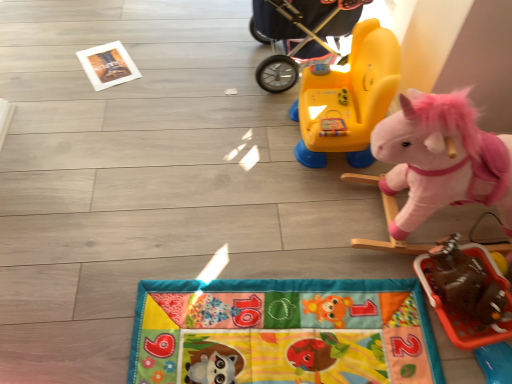
Identify the location of yellow plastic baby carriage at upper center. (298, 33).

The image size is (512, 384). I want to click on yellow plastic rocker at upper center, the 3th toy when ordered from bottom to top, so click(348, 99).

Locate an element on the screen. This screenshot has height=384, width=512. yellow plastic baby carriage at upper center is located at coordinates (298, 33).

Which object is more forward, brown fuzzy elephant at lower right, positioned as the first toy in bottom-to-top order, or yellow plastic rocker at upper center, the 3th toy when ordered from bottom to top?

brown fuzzy elephant at lower right, positioned as the first toy in bottom-to-top order.

Considering the positions of objects brown fuzzy elephant at lower right, positioned as the first toy in bottom-to-top order, and yellow plastic rocker at upper center, the 3th toy when ordered from bottom to top, in the image provided, who is more to the left, brown fuzzy elephant at lower right, positioned as the first toy in bottom-to-top order, or yellow plastic rocker at upper center, the 3th toy when ordered from bottom to top,?

yellow plastic rocker at upper center, the 3th toy when ordered from bottom to top, is more to the left.

Consider the image. Are brown fuzzy elephant at lower right, positioned as the first toy in bottom-to-top order, and yellow plastic rocker at upper center, the 3th toy when ordered from bottom to top, located far from each other?

No.

Based on the photo, from a real-world perspective, relative to yellow plastic rocker at upper center, which appears as the 1th toy when viewed from the top, is brown fuzzy elephant at lower right, positioned as the first toy in bottom-to-top order, vertically above or below?

brown fuzzy elephant at lower right, positioned as the first toy in bottom-to-top order, is situated lower than yellow plastic rocker at upper center, which appears as the 1th toy when viewed from the top, in the real world.

You are a GUI agent. You are given a task and a screenshot of the screen. Output one action in this format:
    pyautogui.click(x=<x>, y=<y>)
    Task: Click on the baby carriage behind the brown fuzzy elephant at lower right, which is the third toy from top to bottom
    
    Given the screenshot: What is the action you would take?
    pyautogui.click(x=298, y=33)

Can you confirm if yellow plastic baby carriage at upper center is shorter than brown fuzzy elephant at lower right, positioned as the first toy in bottom-to-top order?

Incorrect, the height of yellow plastic baby carriage at upper center does not fall short of that of brown fuzzy elephant at lower right, positioned as the first toy in bottom-to-top order.

Would you say yellow plastic baby carriage at upper center is outside brown fuzzy elephant at lower right, which is the third toy from top to bottom?

yellow plastic baby carriage at upper center is positioned outside brown fuzzy elephant at lower right, which is the third toy from top to bottom.

Considering the positions of points (263, 72) and (440, 271), is point (263, 72) farther from camera compared to point (440, 271)?

Yes, point (263, 72) is behind point (440, 271).

Does point (428, 267) come behind point (345, 30)?

No, (428, 267) is closer to viewer.

How many degrees apart are the facing directions of brown fuzzy elephant at lower right, positioned as the first toy in bottom-to-top order, and yellow plastic baby carriage at upper center?

They differ by 1.54 degrees in their facing directions.

In terms of size, does brown fuzzy elephant at lower right, positioned as the first toy in bottom-to-top order, appear bigger or smaller than yellow plastic baby carriage at upper center?

Considering their sizes, brown fuzzy elephant at lower right, positioned as the first toy in bottom-to-top order, takes up less space than yellow plastic baby carriage at upper center.

Considering the sizes of objects brown fuzzy elephant at lower right, positioned as the first toy in bottom-to-top order, and yellow plastic baby carriage at upper center in the image provided, who is taller, brown fuzzy elephant at lower right, positioned as the first toy in bottom-to-top order, or yellow plastic baby carriage at upper center?

yellow plastic baby carriage at upper center.

Can you confirm if brown fuzzy elephant at lower right, which is the third toy from top to bottom, is thinner than pink plush unicorn at right, marked as the 2th toy in a bottom-to-top arrangement?

Indeed, brown fuzzy elephant at lower right, which is the third toy from top to bottom, has a lesser width compared to pink plush unicorn at right, marked as the 2th toy in a bottom-to-top arrangement.

From a real-world perspective, is brown fuzzy elephant at lower right, which is the third toy from top to bottom, beneath pink plush unicorn at right, positioned as the 2th toy in top-to-bottom order?

Indeed, from a real-world perspective, brown fuzzy elephant at lower right, which is the third toy from top to bottom, is positioned beneath pink plush unicorn at right, positioned as the 2th toy in top-to-bottom order.

The image size is (512, 384). Identify the location of toy in front of the brown fuzzy elephant at lower right, which is the third toy from top to bottom. (442, 159).

Consider the image. Would you say brown fuzzy elephant at lower right, positioned as the first toy in bottom-to-top order, contains pink plush unicorn at right, marked as the 2th toy in a bottom-to-top arrangement?

No, pink plush unicorn at right, marked as the 2th toy in a bottom-to-top arrangement, is not inside brown fuzzy elephant at lower right, positioned as the first toy in bottom-to-top order.

From a real-world perspective, is yellow plastic rocker at upper center, the 3th toy when ordered from bottom to top, above or below pink plush unicorn at right, positioned as the 2th toy in top-to-bottom order?

In terms of real-world spatial position, yellow plastic rocker at upper center, the 3th toy when ordered from bottom to top, is below pink plush unicorn at right, positioned as the 2th toy in top-to-bottom order.

Can you confirm if yellow plastic rocker at upper center, the 3th toy when ordered from bottom to top, is positioned to the right of pink plush unicorn at right, positioned as the 2th toy in top-to-bottom order?

No.

Consider the image. How many degrees apart are the facing directions of yellow plastic rocker at upper center, which appears as the 1th toy when viewed from the top, and pink plush unicorn at right, positioned as the 2th toy in top-to-bottom order?

yellow plastic rocker at upper center, which appears as the 1th toy when viewed from the top, and pink plush unicorn at right, positioned as the 2th toy in top-to-bottom order, are facing 0.00169 degrees away from each other.

From the image's perspective, is yellow plastic rocker at upper center, which appears as the 1th toy when viewed from the top, positioned above or below pink plush unicorn at right, positioned as the 2th toy in top-to-bottom order?

Clearly, from the image's perspective, yellow plastic rocker at upper center, which appears as the 1th toy when viewed from the top, is above pink plush unicorn at right, positioned as the 2th toy in top-to-bottom order.

From the image's perspective, is yellow plastic rocker at upper center, which appears as the 1th toy when viewed from the top, above or below brown fuzzy elephant at lower right, which is the third toy from top to bottom?

From the image's perspective, yellow plastic rocker at upper center, which appears as the 1th toy when viewed from the top, appears above brown fuzzy elephant at lower right, which is the third toy from top to bottom.

Who is more distant, yellow plastic rocker at upper center, the 3th toy when ordered from bottom to top, or brown fuzzy elephant at lower right, which is the third toy from top to bottom?

yellow plastic rocker at upper center, the 3th toy when ordered from bottom to top.

Considering the sizes of objects yellow plastic rocker at upper center, the 3th toy when ordered from bottom to top, and brown fuzzy elephant at lower right, positioned as the first toy in bottom-to-top order, in the image provided, who is taller, yellow plastic rocker at upper center, the 3th toy when ordered from bottom to top, or brown fuzzy elephant at lower right, positioned as the first toy in bottom-to-top order,?

yellow plastic rocker at upper center, the 3th toy when ordered from bottom to top, is taller.

The image size is (512, 384). What are the coordinates of `toy located behind the brown fuzzy elephant at lower right, positioned as the first toy in bottom-to-top order` in the screenshot? It's located at (348, 99).

Visually, is pink plush unicorn at right, positioned as the 2th toy in top-to-bottom order, positioned to the left or to the right of yellow plastic rocker at upper center, which appears as the 1th toy when viewed from the top?

Clearly, pink plush unicorn at right, positioned as the 2th toy in top-to-bottom order, is on the right of yellow plastic rocker at upper center, which appears as the 1th toy when viewed from the top, in the image.

Looking at this image, looking at the image, does pink plush unicorn at right, positioned as the 2th toy in top-to-bottom order, seem bigger or smaller compared to yellow plastic rocker at upper center, the 3th toy when ordered from bottom to top?

pink plush unicorn at right, positioned as the 2th toy in top-to-bottom order, is bigger than yellow plastic rocker at upper center, the 3th toy when ordered from bottom to top.

Are pink plush unicorn at right, positioned as the 2th toy in top-to-bottom order, and yellow plastic rocker at upper center, the 3th toy when ordered from bottom to top, beside each other?

pink plush unicorn at right, positioned as the 2th toy in top-to-bottom order, is not next to yellow plastic rocker at upper center, the 3th toy when ordered from bottom to top, and they're not touching.

Is pink plush unicorn at right, marked as the 2th toy in a bottom-to-top arrangement, wider than yellow plastic rocker at upper center, the 3th toy when ordered from bottom to top?

Yes.

This screenshot has width=512, height=384. I want to click on toy that appears behind the brown fuzzy elephant at lower right, positioned as the first toy in bottom-to-top order, so click(x=348, y=99).

From a real-world perspective, which toy is the 2nd one underneath the yellow plastic baby carriage at upper center? Please provide its 2D coordinates.

[(465, 294)]

Which object lies nearer to the anchor point yellow plastic baby carriage at upper center, brown fuzzy elephant at lower right, positioned as the first toy in bottom-to-top order, or pink plush unicorn at right, marked as the 2th toy in a bottom-to-top arrangement?

Based on the image, pink plush unicorn at right, marked as the 2th toy in a bottom-to-top arrangement, appears to be nearer to yellow plastic baby carriage at upper center.

When comparing their distances from pink plush unicorn at right, marked as the 2th toy in a bottom-to-top arrangement, does brown fuzzy elephant at lower right, which is the third toy from top to bottom, or yellow plastic baby carriage at upper center seem closer?

brown fuzzy elephant at lower right, which is the third toy from top to bottom.

From the image, which object appears to be nearer to pink plush unicorn at right, positioned as the 2th toy in top-to-bottom order, yellow plastic baby carriage at upper center or brown fuzzy elephant at lower right, which is the third toy from top to bottom?

brown fuzzy elephant at lower right, which is the third toy from top to bottom, is closer to pink plush unicorn at right, positioned as the 2th toy in top-to-bottom order.

From the image, which object appears to be nearer to pink plush unicorn at right, marked as the 2th toy in a bottom-to-top arrangement, yellow plastic rocker at upper center, which appears as the 1th toy when viewed from the top, or yellow plastic baby carriage at upper center?

yellow plastic rocker at upper center, which appears as the 1th toy when viewed from the top, is positioned closer to the anchor pink plush unicorn at right, marked as the 2th toy in a bottom-to-top arrangement.

Which object lies nearer to the anchor point pink plush unicorn at right, positioned as the 2th toy in top-to-bottom order, brown fuzzy elephant at lower right, which is the third toy from top to bottom, or yellow plastic rocker at upper center, which appears as the 1th toy when viewed from the top?

brown fuzzy elephant at lower right, which is the third toy from top to bottom, is closer to pink plush unicorn at right, positioned as the 2th toy in top-to-bottom order.

Considering their positions, is pink plush unicorn at right, positioned as the 2th toy in top-to-bottom order, positioned further to yellow plastic rocker at upper center, the 3th toy when ordered from bottom to top, than yellow plastic baby carriage at upper center?

Among the two, pink plush unicorn at right, positioned as the 2th toy in top-to-bottom order, is located further to yellow plastic rocker at upper center, the 3th toy when ordered from bottom to top.

Based on their spatial positions, is yellow plastic rocker at upper center, the 3th toy when ordered from bottom to top, or pink plush unicorn at right, marked as the 2th toy in a bottom-to-top arrangement, further from yellow plastic baby carriage at upper center?

Among the two, pink plush unicorn at right, marked as the 2th toy in a bottom-to-top arrangement, is located further to yellow plastic baby carriage at upper center.

When comparing their distances from pink plush unicorn at right, marked as the 2th toy in a bottom-to-top arrangement, does yellow plastic baby carriage at upper center or yellow plastic rocker at upper center, the 3th toy when ordered from bottom to top, seem further?

Among the two, yellow plastic baby carriage at upper center is located further to pink plush unicorn at right, marked as the 2th toy in a bottom-to-top arrangement.

The width and height of the screenshot is (512, 384). Identify the location of toy between yellow plastic rocker at upper center, which appears as the 1th toy when viewed from the top, and brown fuzzy elephant at lower right, which is the third toy from top to bottom, in the up-down direction. (442, 159).

Where is `toy between yellow plastic baby carriage at upper center and pink plush unicorn at right, marked as the 2th toy in a bottom-to-top arrangement, in the up-down direction`? toy between yellow plastic baby carriage at upper center and pink plush unicorn at right, marked as the 2th toy in a bottom-to-top arrangement, in the up-down direction is located at coordinates (348, 99).